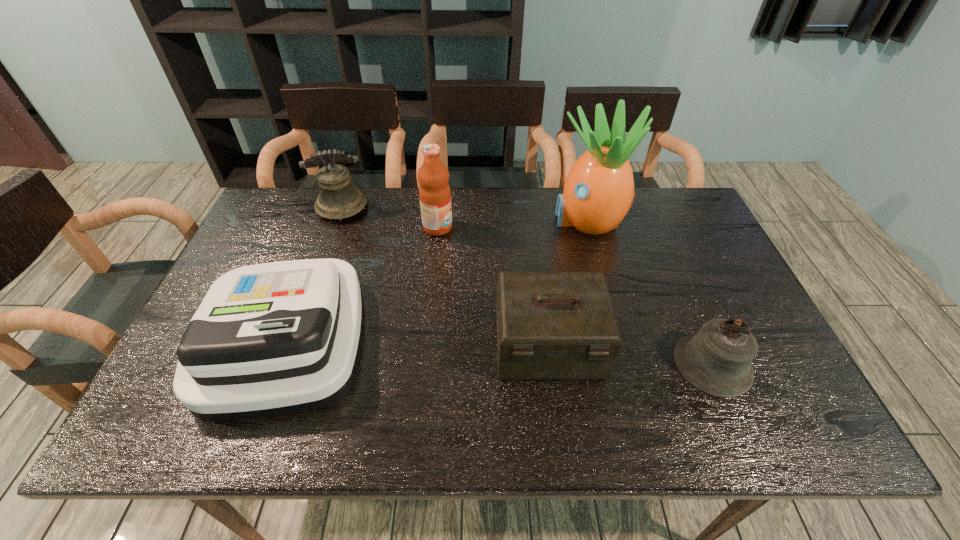
Locate an element on the screen. blank area located 0.200m at the entrance of the tallest object is located at coordinates (488, 219).

Locate an element on the screen. The width and height of the screenshot is (960, 540). vacant space situated at the entrance of the tallest object is located at coordinates (466, 219).

Identify the location of vacant space located on the front label of the third object from left to right. (526, 227).

In order to click on vacant position located on the right of the taller bell in this screenshot , I will do `click(412, 208)`.

The image size is (960, 540). What are the coordinates of `free location located 0.400m on the right of the cash register` in the screenshot? It's located at (527, 339).

At what (x,y) coordinates should I click in order to perform the action: click on vacant space located on the right of the first-aid kit. Please return your answer as a coordinate pair (x, y). Looking at the image, I should click on (695, 346).

I want to click on vacant space located on the back of the shorter bell, so click(682, 292).

Image resolution: width=960 pixels, height=540 pixels. What are the coordinates of `pineapple located in the far edge section of the desktop` in the screenshot? It's located at (598, 192).

Locate an element on the screen. fruit juice that is at the far edge is located at coordinates (434, 191).

In order to click on bell present at the far edge in this screenshot , I will do `click(338, 199)`.